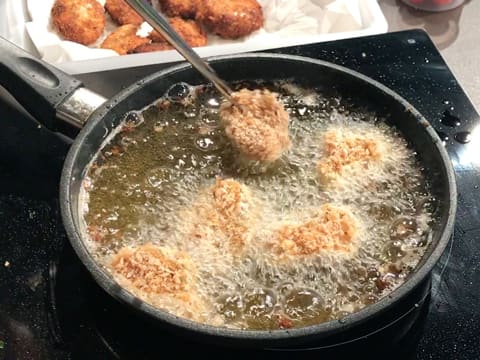
Where is `utensil`? The height and width of the screenshot is (360, 480). utensil is located at coordinates pos(158,18).